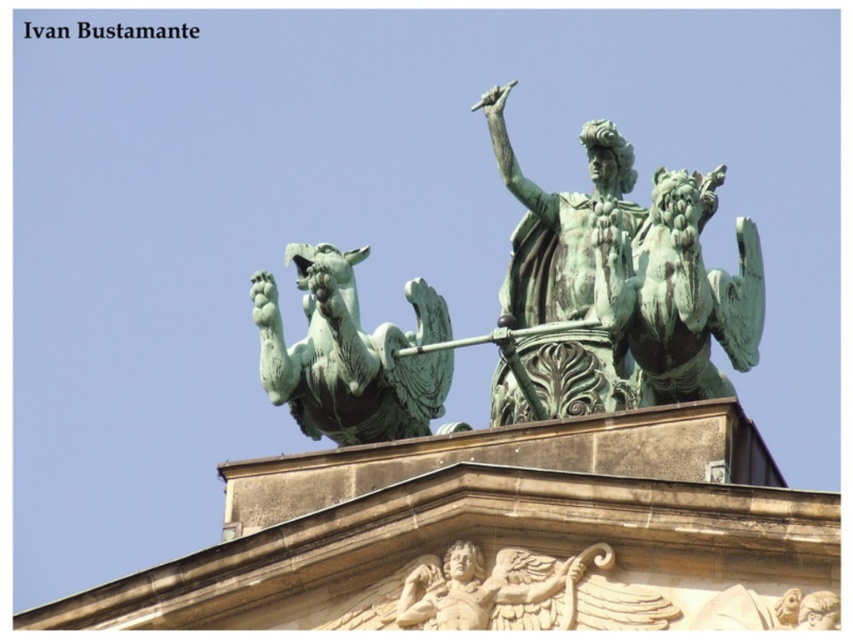
Question: Among these points, which one is nearest to the camera?

Choices:
 (A) (346, 412)
 (B) (582, 208)

Answer: (A)

Question: Is green patina statue at upper center further to camera compared to green patina griffin at upper left?

Choices:
 (A) yes
 (B) no

Answer: (B)

Question: Is green patina statue at upper center below green patina griffin at upper left?

Choices:
 (A) yes
 (B) no

Answer: (B)

Question: From the image, what is the correct spatial relationship of green patina statue at upper center in relation to green patina griffin at upper left?

Choices:
 (A) below
 (B) above

Answer: (B)